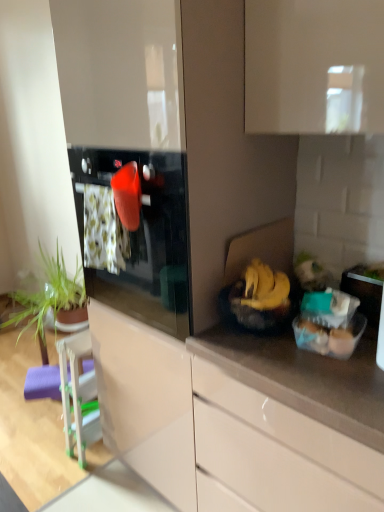
The height and width of the screenshot is (512, 384). What do you see at coordinates (78, 394) in the screenshot?
I see `white glossy chair at lower left, positioned as the second appliance in right-to-left order` at bounding box center [78, 394].

At what (x,y) coordinates should I click in order to perform the action: click on glossy white cabinet at lower center. Please return your answer as a coordinate pair (x, y). Looking at the image, I should click on (242, 415).

What is the approximate height of clear plastic container at right, the second appliance from the back?

It is 6.72 inches.

Describe the element at coordinates (135, 233) in the screenshot. I see `glossy black oven at center` at that location.

What is the approximate height of yellow matte bananas at right?

The height of yellow matte bananas at right is 8.01 centimeters.

This screenshot has width=384, height=512. What are the coordinates of `white glossy chair at lower left, which is counted as the 1th appliance, starting from the back` in the screenshot? It's located at (78, 394).

Would you say glossy white cabinet at lower center is outside white glossy chair at lower left, arranged as the first appliance when ordered from the bottom?

glossy white cabinet at lower center lies outside white glossy chair at lower left, arranged as the first appliance when ordered from the bottom,'s area.

In the scene shown: Can you confirm if glossy white cabinet at lower center is thinner than white glossy chair at lower left, which appears as the second appliance when viewed from the front?

In fact, glossy white cabinet at lower center might be wider than white glossy chair at lower left, which appears as the second appliance when viewed from the front.

Can you confirm if glossy white cabinet at lower center is shorter than white glossy chair at lower left, arranged as the first appliance when ordered from the bottom?

No, glossy white cabinet at lower center is not shorter than white glossy chair at lower left, arranged as the first appliance when ordered from the bottom.

Are glossy white cabinet at lower center and white glossy chair at lower left, which appears as the second appliance when viewed from the top, beside each other?

They are not placed beside each other.

Considering the relative sizes of clear plastic container at right, placed as the 1th appliance when sorted from front to back, and purple foam bar stool at lower left in the image provided, is clear plastic container at right, placed as the 1th appliance when sorted from front to back, smaller than purple foam bar stool at lower left?

Actually, clear plastic container at right, placed as the 1th appliance when sorted from front to back, might be larger than purple foam bar stool at lower left.

From the picture: Between clear plastic container at right, arranged as the first appliance when viewed from the top, and purple foam bar stool at lower left, which one has smaller width?

With smaller width is purple foam bar stool at lower left.

From a real-world perspective, is clear plastic container at right, the 2th appliance ordered from the bottom, located higher than purple foam bar stool at lower left?

Yes.

Is point (350, 283) closer to viewer compared to point (49, 382)?

Yes.

Can you tell me how much clear plastic container at right, marked as the 1th appliance in a right-to-left arrangement, and translucent plastic eggs at right differ in facing direction?

The facing directions of clear plastic container at right, marked as the 1th appliance in a right-to-left arrangement, and translucent plastic eggs at right are 0.00139 degrees apart.

You are a GUI agent. You are given a task and a screenshot of the screen. Output one action in this format:
    pyautogui.click(x=<x>, y=<y>)
    Task: Click on the appliance that appears above the translucent plastic eggs at right (from a real-world perspective)
    The width and height of the screenshot is (384, 512).
    Given the screenshot: What is the action you would take?
    pyautogui.click(x=365, y=289)

Is clear plastic container at right, the 2th appliance ordered from the bottom, in front of translucent plastic eggs at right?

That is False.

In the scene shown: Considering the relative sizes of green leafy plant at left and glossy black oven at center in the image provided, is green leafy plant at left taller than glossy black oven at center?

No.

Considering the positions of objects green leafy plant at left and glossy black oven at center in the image provided, who is more to the left, green leafy plant at left or glossy black oven at center?

green leafy plant at left.

Looking at this image, from a real-world perspective, is green leafy plant at left physically above glossy black oven at center?

No, from a real-world perspective, green leafy plant at left is not above glossy black oven at center.

Is green leafy plant at left not inside glossy black oven at center?

Indeed, green leafy plant at left is completely outside glossy black oven at center.

Is the depth of purple foam bar stool at lower left greater than that of green leafy plant at left?

Yes, purple foam bar stool at lower left is further from the camera.

Considering the relative sizes of purple foam bar stool at lower left and green leafy plant at left in the image provided, is purple foam bar stool at lower left shorter than green leafy plant at left?

Yes.

Between purple foam bar stool at lower left and green leafy plant at left, which one appears on the left side from the viewer's perspective?

purple foam bar stool at lower left is more to the left.

Based on the photo, is glossy white cabinet at lower center taller than yellow matte bananas at right?

Yes.

Based on their sizes in the image, would you say glossy white cabinet at lower center is bigger or smaller than yellow matte bananas at right?

glossy white cabinet at lower center is bigger than yellow matte bananas at right.

Which object is positioned more to the right, glossy white cabinet at lower center or yellow matte bananas at right?

glossy white cabinet at lower center is more to the right.

Is point (271, 287) positioned in front of point (163, 315)?

Yes, point (271, 287) is closer to viewer.

Is yellow matte bananas at right oriented towards glossy black oven at center?

No.

In the image, is yellow matte bananas at right positioned in front of or behind glossy black oven at center?

Visually, yellow matte bananas at right is located behind glossy black oven at center.

Between yellow matte bananas at right and glossy black oven at center, which one has larger size?

Bigger between the two is glossy black oven at center.

Starting from the glossy white cabinet at lower center, which appliance is the 2nd one behind? Please provide its 2D coordinates.

[(78, 394)]

Where is `appliance that is the 2nd one when counting rightward from the purple foam bar stool at lower left`? The width and height of the screenshot is (384, 512). appliance that is the 2nd one when counting rightward from the purple foam bar stool at lower left is located at coordinates (365, 289).

When comparing their distances from purple foam bar stool at lower left, does clear plastic container at right, placed as the 1th appliance when sorted from front to back, or white glossy chair at lower left, arranged as the first appliance when ordered from the bottom, seem further?

clear plastic container at right, placed as the 1th appliance when sorted from front to back, is positioned further to the anchor purple foam bar stool at lower left.

Estimate the real-world distances between objects in this image. Which object is further from clear plastic container at right, the 2th appliance ordered from the bottom, translucent plastic eggs at right or yellow matte bananas at right?

Based on the image, yellow matte bananas at right appears to be further to clear plastic container at right, the 2th appliance ordered from the bottom.

Which object lies nearer to the anchor point yellow matte bananas at right, translucent plastic eggs at right or glossy white cabinet at lower center?

translucent plastic eggs at right is positioned closer to the anchor yellow matte bananas at right.

Estimate the real-world distances between objects in this image. Which object is closer to yellow matte bananas at right, white glossy chair at lower left, which appears as the second appliance when viewed from the top, or glossy black oven at center?

glossy black oven at center is positioned closer to the anchor yellow matte bananas at right.

From the image, which object appears to be nearer to purple foam bar stool at lower left, green leafy plant at left or white glossy chair at lower left, positioned as the second appliance in right-to-left order?

white glossy chair at lower left, positioned as the second appliance in right-to-left order.

Which object lies further to the anchor point white glossy chair at lower left, which is counted as the 1th appliance, starting from the back, purple foam bar stool at lower left or clear plastic container at right, placed as the 1th appliance when sorted from front to back?

clear plastic container at right, placed as the 1th appliance when sorted from front to back, lies further to white glossy chair at lower left, which is counted as the 1th appliance, starting from the back, than the other object.

Estimate the real-world distances between objects in this image. Which object is further from translucent plastic eggs at right, green leafy plant at left or glossy black oven at center?

The object further to translucent plastic eggs at right is green leafy plant at left.

Looking at the image, which one is located closer to purple foam bar stool at lower left, green leafy plant at left or glossy black oven at center?

green leafy plant at left is positioned closer to the anchor purple foam bar stool at lower left.

The height and width of the screenshot is (512, 384). Find the location of `banana between green leafy plant at left and clear plastic container at right, arranged as the first appliance when viewed from the top, from left to right`. banana between green leafy plant at left and clear plastic container at right, arranged as the first appliance when viewed from the top, from left to right is located at coordinates (264, 287).

The width and height of the screenshot is (384, 512). What are the coordinates of `appliance between green leafy plant at left and yellow matte bananas at right in the horizontal direction` in the screenshot? It's located at tap(78, 394).

Locate an element on the screen. This screenshot has height=512, width=384. oven situated between green leafy plant at left and glossy white cabinet at lower center from left to right is located at coordinates click(135, 233).

Find the location of a particular element. houseplant between purple foam bar stool at lower left and glossy white cabinet at lower center in the horizontal direction is located at coordinates (50, 296).